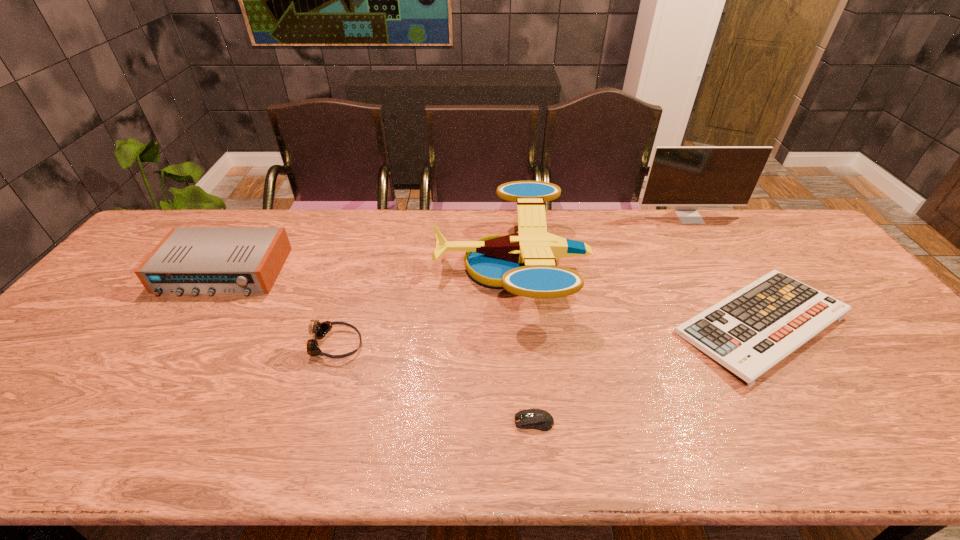
Identify the location of free point located at the cockpit of the drone. (369, 268).

The image size is (960, 540). In order to click on vacant area situated 0.370m at the cockpit of the drone in this screenshot , I will do `click(313, 268)`.

In order to click on vacant space situated at the cockpit of the drone in this screenshot , I will do `click(378, 268)`.

What are the coordinates of `vacant space positioned 0.250m on the front panel of the leftmost object` in the screenshot? It's located at (158, 372).

Image resolution: width=960 pixels, height=540 pixels. What are the coordinates of `free space located 0.380m through the lenses of the fifth object from right to left` in the screenshot? It's located at (513, 345).

The width and height of the screenshot is (960, 540). Find the location of `vacant space located on the front of the second shortest object`. vacant space located on the front of the second shortest object is located at coordinates (833, 439).

Where is `vacant space situated on the button of the nearest object`? The width and height of the screenshot is (960, 540). vacant space situated on the button of the nearest object is located at coordinates (349, 422).

Find the location of a particular element. vacant space located on the button of the nearest object is located at coordinates (487, 422).

At what (x,y) coordinates should I click in order to perform the action: click on vacant space located on the button of the nearest object. Please return your answer as a coordinate pair (x, y). Looking at the image, I should click on (349, 422).

The height and width of the screenshot is (540, 960). I want to click on monitor that is at the far edge, so click(x=686, y=177).